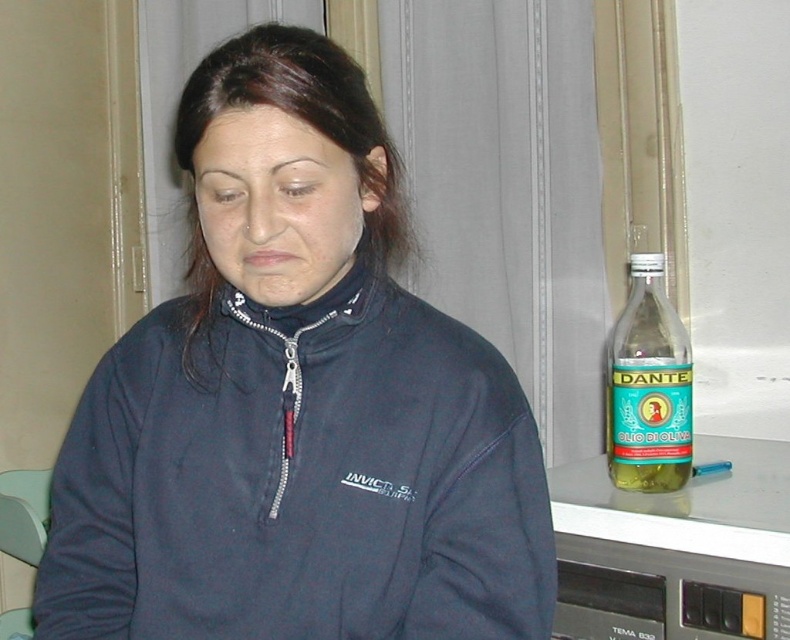
From the picture: You need to place a decorative item on the table next to the dark blue fleece at center and the green glass bottle at right. Which object should you place it closer to if you want to ensure it doesn

The dark blue fleece at center is wider than the green glass bottle at right, so placing the decorative item closer to the dark blue fleece at center would provide more space between them.

You are a delivery person who needs to place a small package on the surface near the dark blue fleece at center and the green glass bottle at right. Which object should you place the package next to to ensure it fits without overlapping either item?

The dark blue fleece at center is larger in size than the green glass bottle at right, so you should place the package next to the green glass bottle at right to ensure it fits without overlapping either item.

You are a delivery person who needs to place a 30 cm wide package on the dark blue fleece at center. Can you fit the package on the fleece without it hanging off the edge? Please explain your reasoning.

The dark blue fleece at center and viewer are 78.68 centimeters apart from each other. Since the package is 30 cm wide, it depends on the fleece size. However, the description only provides the distance between the fleece and the viewer, not the fleece dimensions. Therefore, we cannot determine if the package will fit based on the given information.